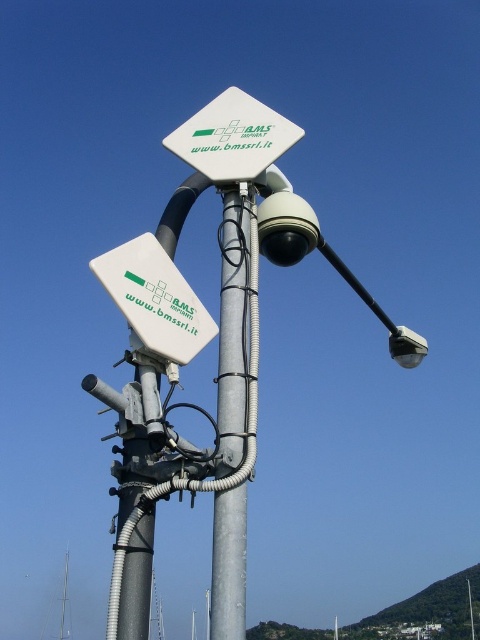
You are a maintenance worker standing at the base of the galvanized metal pole at center. You need to reach the white plastic sign at upper center for inspection. Given that your ladder can extend up to 6 meters, will you be able to reach the sign?

The distance between the galvanized metal pole at center and the white plastic sign at upper center is 6.35 meters. Since your ladder only extends to 6 meters, you won